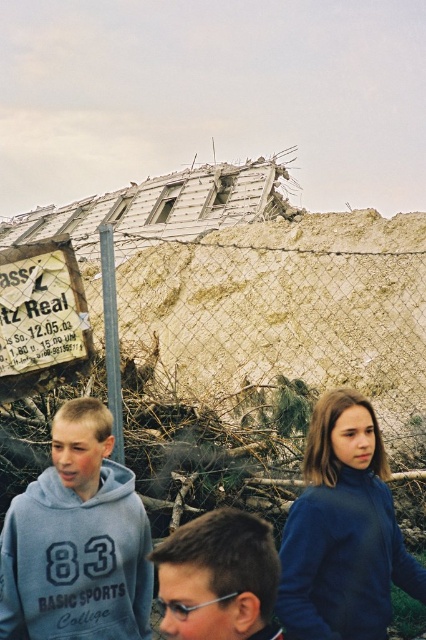
Is gray fleece sweatshirt at center positioned in front of blue fleece jacket at center?

No.

In the scene shown: Between gray fleece sweatshirt at center and blue fleece jacket at center, which one has less height?

With less height is blue fleece jacket at center.

Who is more distant from viewer, [138,528] or [360,449]?

Point [360,449]

What are the coordinates of `gray fleece sweatshirt at center` in the screenshot? It's located at (77, 540).

Is wire mesh fence at center to the right of dark brown hair at center from the viewer's perspective?

Incorrect, wire mesh fence at center is not on the right side of dark brown hair at center.

Is wire mesh fence at center further to camera compared to dark brown hair at center?

Yes, it is behind dark brown hair at center.

This screenshot has height=640, width=426. I want to click on wire mesh fence at center, so click(x=261, y=355).

Which is in front, point (36, 445) or point (43, 522)?

Positioned in front is point (43, 522).

Which is more to the right, wire mesh fence at center or gray fleece sweatshirt at center?

From the viewer's perspective, wire mesh fence at center appears more on the right side.

Measure the distance between point (382,368) and camera.

Point (382,368) is 226.76 feet away from camera.

Image resolution: width=426 pixels, height=640 pixels. I want to click on wire mesh fence at center, so click(261, 355).